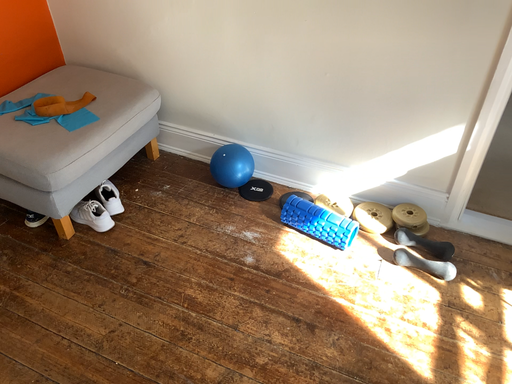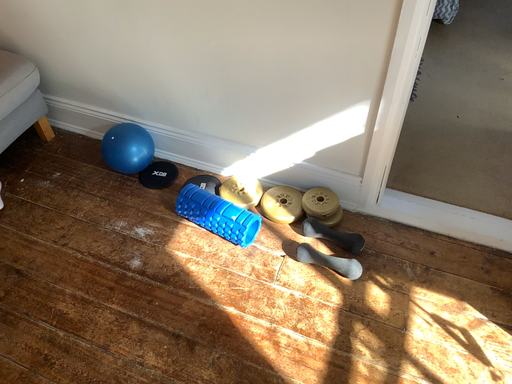
Question: How did the camera likely rotate when shooting the video?

Choices:
 (A) rotated downward
 (B) rotated upward

Answer: (A)